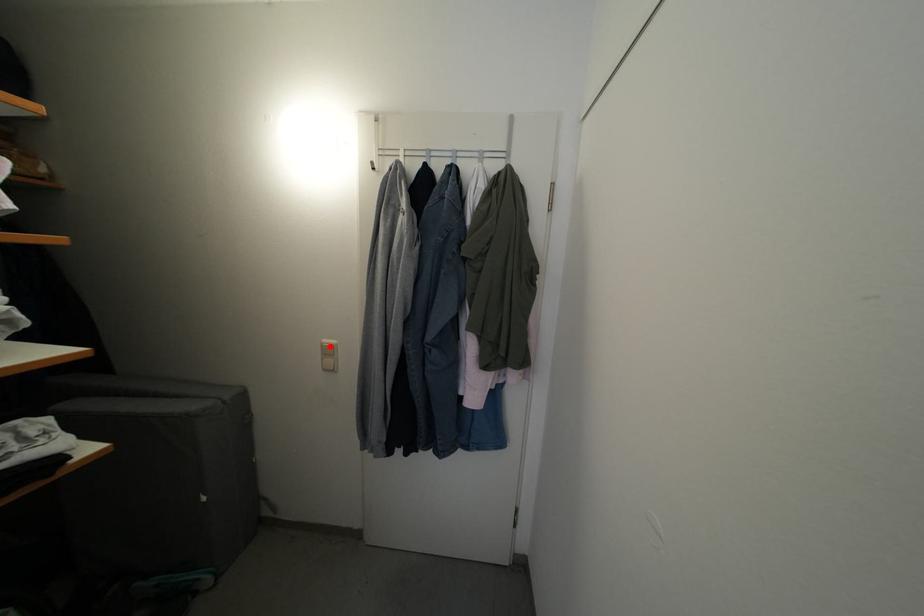
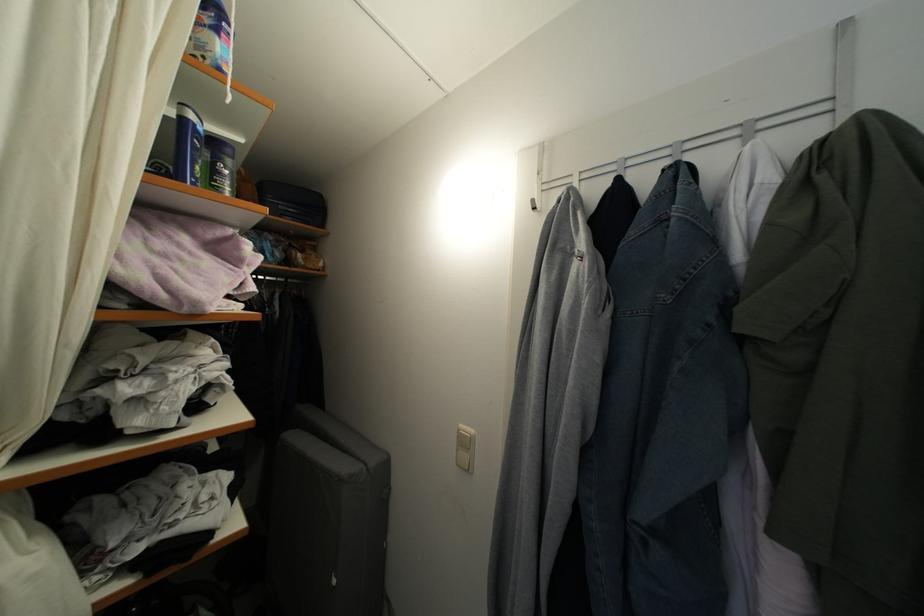
The point at the highlighted location is marked in the first image. Where is the corresponding point in the second image?

(467, 432)